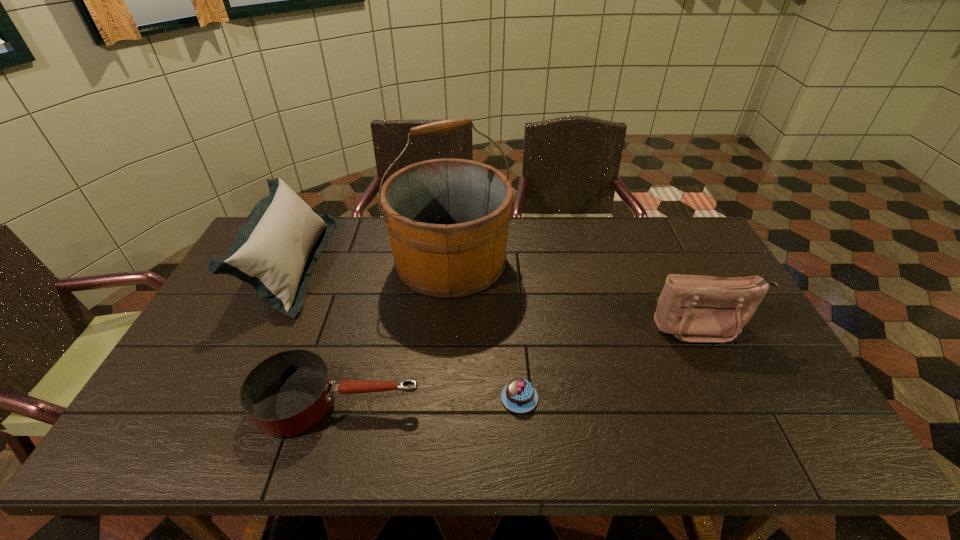
At what (x,y) coordinates should I click in order to perform the action: click on bucket. Please return your answer as a coordinate pair (x, y). Looking at the image, I should click on (447, 219).

Identify the location of cushion. The image size is (960, 540). (276, 248).

Where is `the rightmost object`? This screenshot has height=540, width=960. the rightmost object is located at coordinates (693, 308).

Where is `pan`? pan is located at coordinates (286, 394).

Identify the location of chocolate cake. (519, 396).

Image resolution: width=960 pixels, height=540 pixels. What are the coordinates of `vacant region located on the right of the tallest object` in the screenshot? It's located at (617, 261).

Where is `free spot located on the surface of the cushion`? The width and height of the screenshot is (960, 540). free spot located on the surface of the cushion is located at coordinates (372, 264).

Locate an element on the screen. vacant area located 0.200m on the front pocket of the rightmost object is located at coordinates (745, 413).

Where is `vacant position located on the handle side of the fourth tallest object`? The image size is (960, 540). vacant position located on the handle side of the fourth tallest object is located at coordinates (486, 402).

The height and width of the screenshot is (540, 960). I want to click on free spot located on the right of the chocolate cake, so click(x=612, y=397).